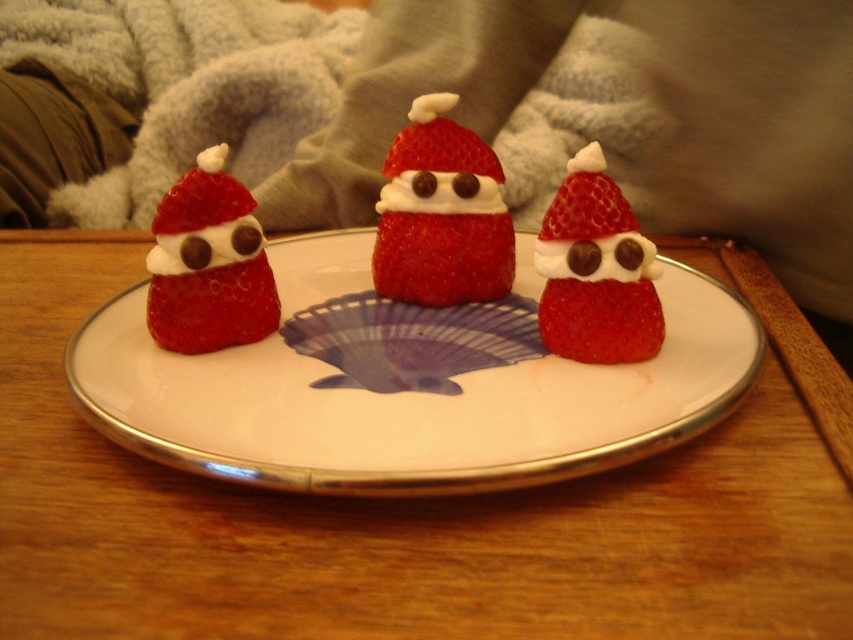
Question: Considering the relative positions of smooth red strawberry at center and matte chocolate strawberry at center in the image provided, where is smooth red strawberry at center located with respect to matte chocolate strawberry at center?

Choices:
 (A) below
 (B) above

Answer: (B)

Question: Which object appears farthest from the camera in this image?

Choices:
 (A) fuzzy gray blanket at upper center
 (B) smooth red strawberry at center
 (C) matte chocolate strawberry at left
 (D) matte chocolate strawberry at center

Answer: (A)

Question: Can you confirm if smooth red strawberry at center is bigger than matte chocolate strawberry at center?

Choices:
 (A) no
 (B) yes

Answer: (B)

Question: Which point is farther from the camera taking this photo?

Choices:
 (A) (277, 296)
 (B) (180, 58)

Answer: (B)

Question: Which of these objects is positioned farthest from the fuzzy gray blanket at upper center?

Choices:
 (A) white glossy plate at center
 (B) smooth red strawberry at center
 (C) matte chocolate strawberry at left
 (D) matte chocolate strawberry at center

Answer: (D)

Question: Can you confirm if fuzzy gray blanket at upper center is positioned to the right of matte chocolate strawberry at center?

Choices:
 (A) yes
 (B) no

Answer: (B)